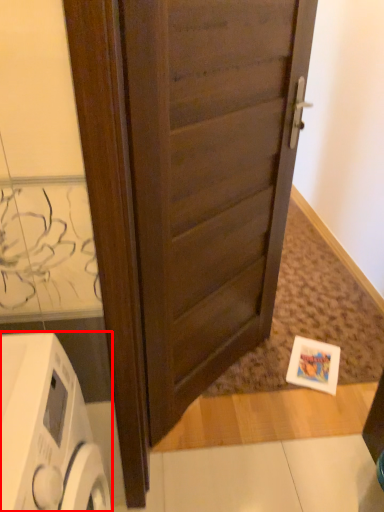
Question: In this image, where is home appliance (annotated by the red box) located relative to door?

Choices:
 (A) left
 (B) right

Answer: (A)